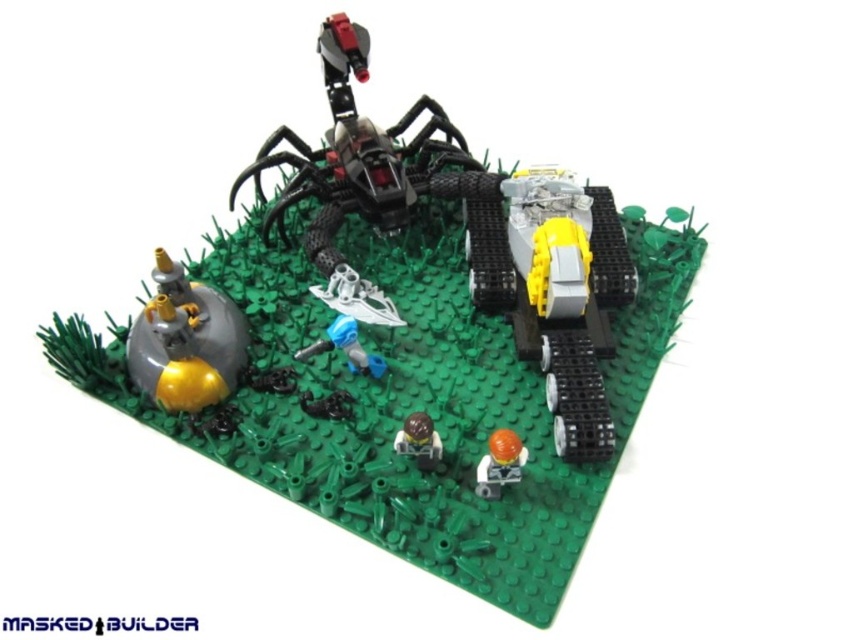
Does orange matte minifigure at lower center have a lesser width compared to brown matte minifigure at center?

No.

Where is `orange matte minifigure at lower center`? Image resolution: width=853 pixels, height=640 pixels. orange matte minifigure at lower center is located at coordinates (498, 464).